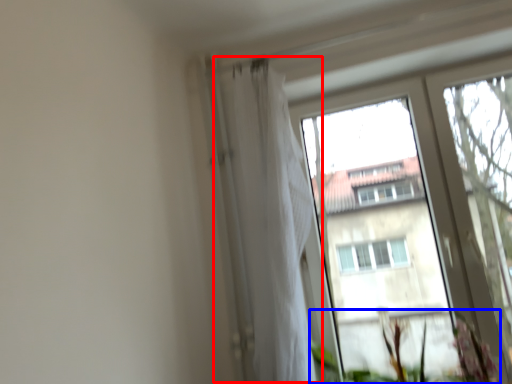
Question: Which point is closer to the camera, shower curtain (highlighted by a red box) or vegetation (highlighted by a blue box)?

Choices:
 (A) shower curtain
 (B) vegetation

Answer: (B)